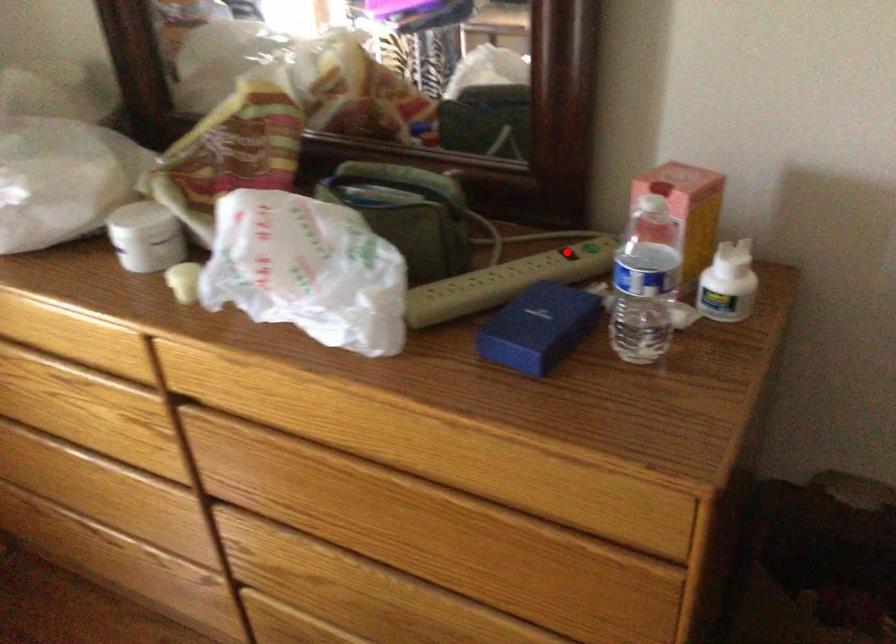
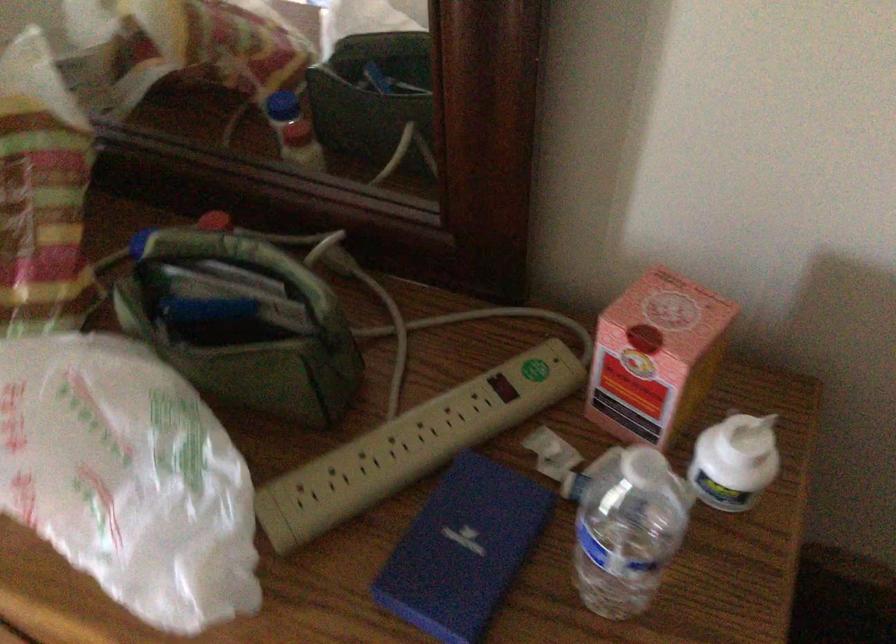
Question: I am providing you with two images of the same scene from different viewpoints. A red point is marked on the first image. Is the red point's position out of view in image 2?

Choices:
 (A) Yes
 (B) No

Answer: (B)